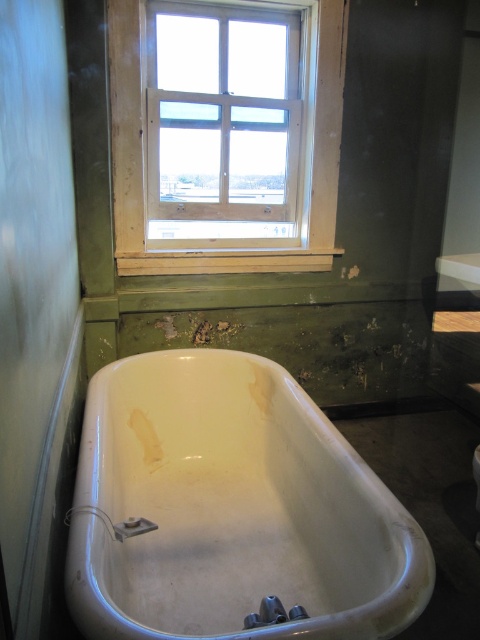
Question: Does white glossy bathtub at lower center appear under white wooden window at upper center?

Choices:
 (A) no
 (B) yes

Answer: (B)

Question: Which point is farther to the camera?

Choices:
 (A) (326, 253)
 (B) (140, 490)

Answer: (A)

Question: Among these points, which one is nearest to the camera?

Choices:
 (A) (336, 112)
 (B) (192, 538)

Answer: (B)

Question: Is white glossy bathtub at lower center thinner than white wooden window at upper center?

Choices:
 (A) yes
 (B) no

Answer: (A)

Question: Does white glossy bathtub at lower center appear under white wooden window at upper center?

Choices:
 (A) no
 (B) yes

Answer: (B)